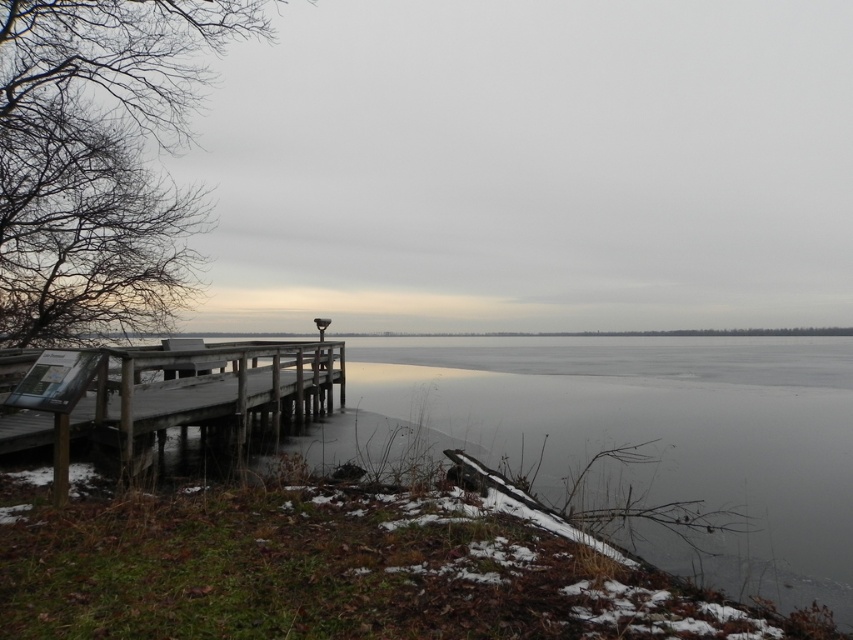
Question: Is transparent ice at lower center smaller than wooden dock at lower left?

Choices:
 (A) no
 (B) yes

Answer: (A)

Question: Is transparent ice at lower center bigger than wooden dock at lower left?

Choices:
 (A) yes
 (B) no

Answer: (A)

Question: Which point is farther to the camera?

Choices:
 (A) transparent ice at lower center
 (B) wooden dock at lower left

Answer: (B)

Question: Which of the following is the farthest from the observer?

Choices:
 (A) wooden dock at lower left
 (B) transparent ice at lower center

Answer: (A)

Question: Can you confirm if transparent ice at lower center is smaller than wooden dock at lower left?

Choices:
 (A) yes
 (B) no

Answer: (B)